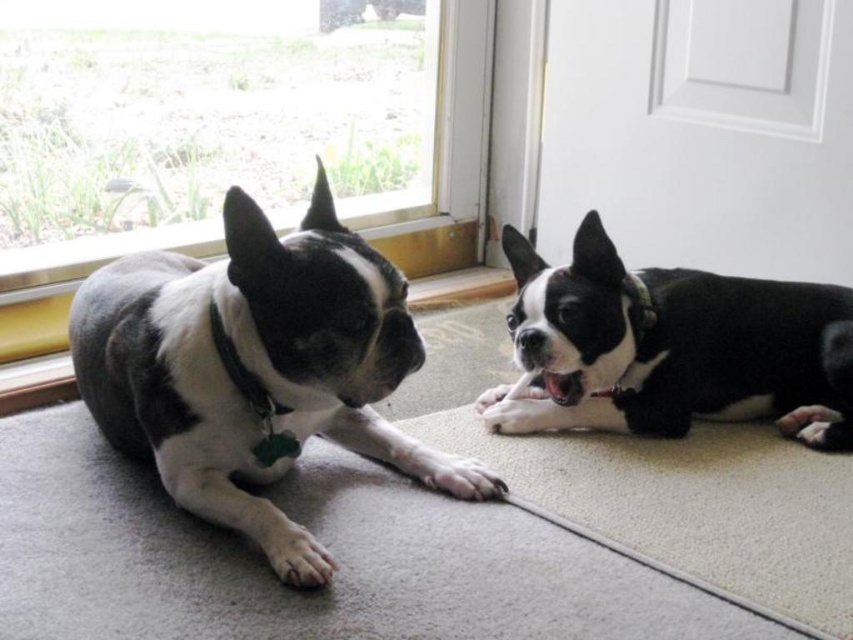
You are a dog owner who wants to ensure your pets have enough space. Based on the scene, can the black and white fur at left fit under the white glossy door at upper right if it needs to pass through?

The black and white fur at left is not as tall as the white glossy door at upper right, so it can fit under the door without any issues.

You are a photographer positioned at the origin point of the image coordinate system. You want to capture a closeup shot of the black and white fur at left. What are the coordinates where you should focus your camera?

The coordinates to focus on are at point (x=254, y=369).

You are a delivery person holding a package that needs to be placed exactly 5 feet away from the white glossy door at upper right. Can you place the package at the camera location?

The white glossy door at upper right and camera are 5.31 feet apart, so placing the package at the camera location would be 5.31 feet away from the door, which is slightly more than 5 feet. Therefore, the package cannot be placed there as it exceeds the required distance.